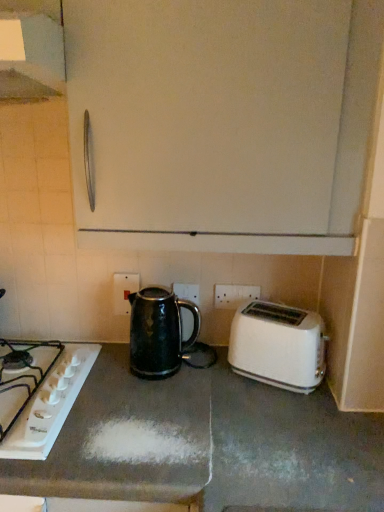
This screenshot has width=384, height=512. I want to click on vacant location below black glossy kettle at center (from a real-world perspective), so click(174, 368).